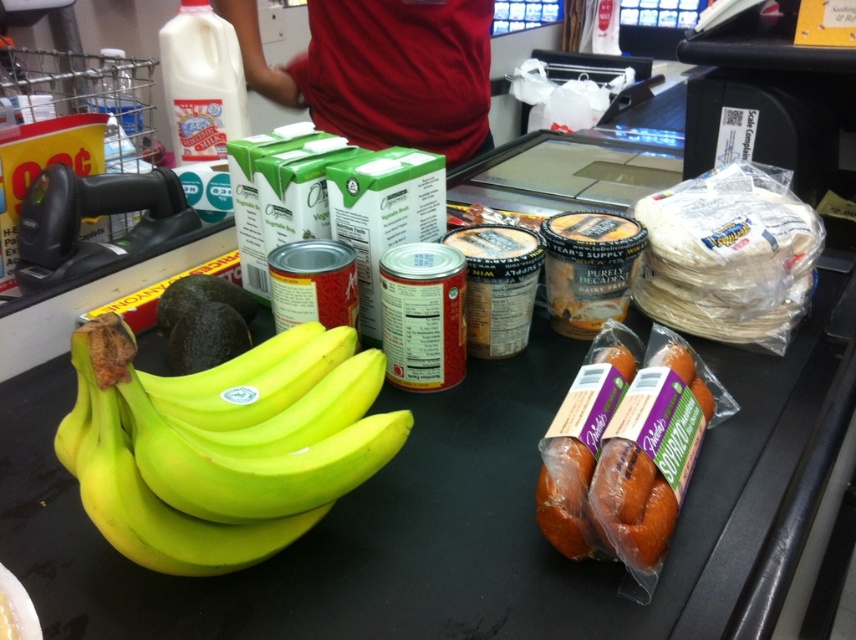
Question: Where is translucent plastic sausage at center right located in relation to white matte yoghurt at upper left in the image?

Choices:
 (A) below
 (B) above

Answer: (A)

Question: Does red smooth shirt at upper center appear on the right side of translucent plastic sausage at center right?

Choices:
 (A) no
 (B) yes

Answer: (A)

Question: Which point is closer to the camera?

Choices:
 (A) (675, 369)
 (B) (349, 129)
 (C) (79, 444)
 (D) (206, 65)

Answer: (C)

Question: Which of the following is the farthest from the observer?

Choices:
 (A) (313, 48)
 (B) (191, 122)
 (C) (664, 528)
 (D) (343, 468)

Answer: (A)

Question: Can you confirm if yellow shiny bananas at left is positioned to the right of red smooth shirt at upper center?

Choices:
 (A) yes
 (B) no

Answer: (A)

Question: Among these objects, which one is farthest from the camera?

Choices:
 (A) yellow shiny bananas at left
 (B) translucent plastic sausage at center right
 (C) red smooth shirt at upper center
 (D) white matte yoghurt at upper left

Answer: (C)